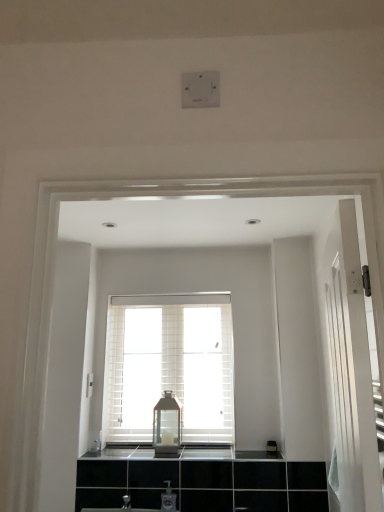
Question: From a real-world perspective, is white textured window at center positioned over clear plastic soap dispenser at lower center based on gravity?

Choices:
 (A) no
 (B) yes

Answer: (B)

Question: Is white textured window at center at the right side of clear plastic soap dispenser at lower center?

Choices:
 (A) no
 (B) yes

Answer: (A)

Question: From a real-world perspective, is white textured window at center positioned under clear plastic soap dispenser at lower center based on gravity?

Choices:
 (A) no
 (B) yes

Answer: (A)

Question: Is white textured window at center facing away from clear plastic soap dispenser at lower center?

Choices:
 (A) yes
 (B) no

Answer: (B)

Question: Can clear plastic soap dispenser at lower center be found inside white textured window at center?

Choices:
 (A) no
 (B) yes

Answer: (A)

Question: Considering the relative sizes of white textured window at center and clear plastic soap dispenser at lower center in the image provided, is white textured window at center taller than clear plastic soap dispenser at lower center?

Choices:
 (A) yes
 (B) no

Answer: (A)

Question: Is clear plastic soap dispenser at lower center far away from white textured window at center?

Choices:
 (A) yes
 (B) no

Answer: (B)

Question: Does clear plastic soap dispenser at lower center have a larger size compared to white textured window at center?

Choices:
 (A) no
 (B) yes

Answer: (A)

Question: Is white textured window at center at the back of clear plastic soap dispenser at lower center?

Choices:
 (A) yes
 (B) no

Answer: (B)

Question: From the image's perspective, is clear plastic soap dispenser at lower center on top of white textured window at center?

Choices:
 (A) yes
 (B) no

Answer: (B)

Question: From a real-world perspective, is clear plastic soap dispenser at lower center located higher than white textured window at center?

Choices:
 (A) no
 (B) yes

Answer: (A)

Question: Is clear plastic soap dispenser at lower center facing towards white textured window at center?

Choices:
 (A) no
 (B) yes

Answer: (A)

Question: Considering the relative positions of matte glass lantern at center and white textured window at center in the image provided, is matte glass lantern at center to the left of white textured window at center from the viewer's perspective?

Choices:
 (A) yes
 (B) no

Answer: (A)